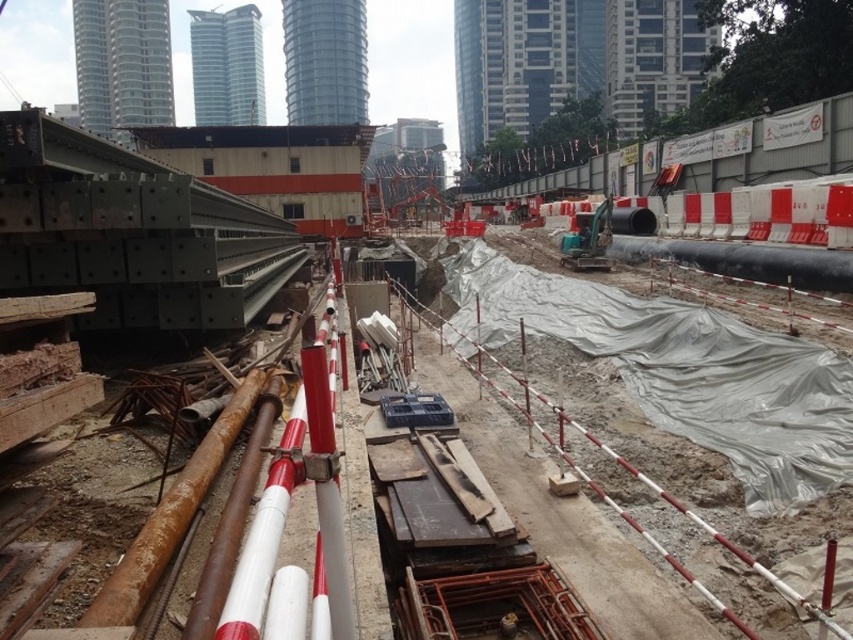
You are a safety inspector standing at the edge of the trench. You need to check the distance between the gray tarpaulin at center and the red fabric construction worker at center. Which object is closer to you?

The gray tarpaulin at center is closer to the viewer than the red fabric construction worker at center.

You are a safety inspector evaluating the construction site. You notice the gray tarpaulin at center and the red fabric construction worker at center. Which object is wider?

The gray tarpaulin at center might be wider than red fabric construction worker at center according to the description provided.